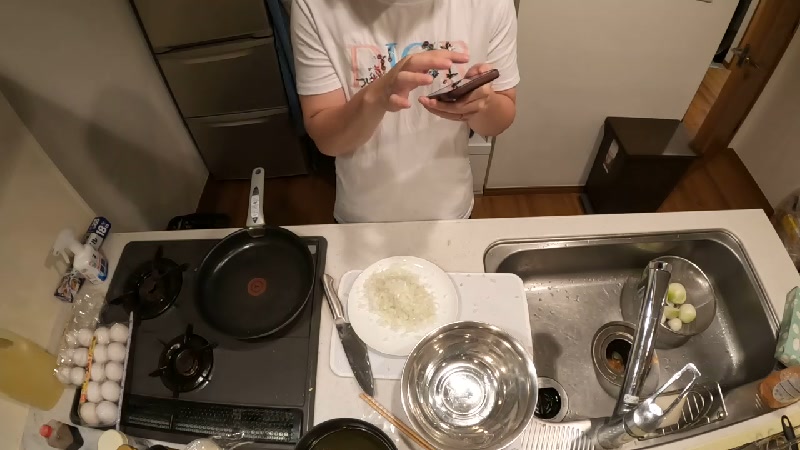
Image resolution: width=800 pixels, height=450 pixels. In order to click on wall in this screenshot , I will do `click(558, 69)`.